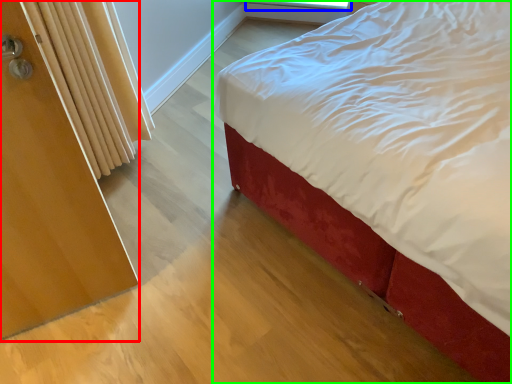
Question: Based on their relative distances, which object is farther from screen door (highlighted by a red box)? Choose from window screen (highlighted by a blue box) and bed (highlighted by a green box).

Choices:
 (A) window screen
 (B) bed

Answer: (A)